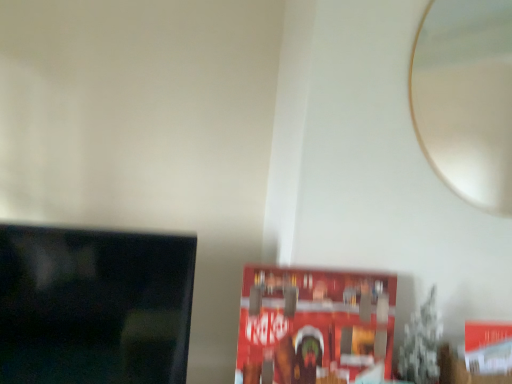
Question: Is white glossy mirror at upper right shorter than black glossy tv at left?

Choices:
 (A) no
 (B) yes

Answer: (A)

Question: Could black glossy tv at left be considered to be inside white glossy mirror at upper right?

Choices:
 (A) no
 (B) yes

Answer: (A)

Question: Is white glossy mirror at upper right located outside black glossy tv at left?

Choices:
 (A) yes
 (B) no

Answer: (A)

Question: Is white glossy mirror at upper right smaller than black glossy tv at left?

Choices:
 (A) yes
 (B) no

Answer: (A)

Question: From the image's perspective, is white glossy mirror at upper right below black glossy tv at left?

Choices:
 (A) no
 (B) yes

Answer: (A)

Question: From a real-world perspective, is white glossy mirror at upper right positioned above or below red matte paperback book at center?

Choices:
 (A) above
 (B) below

Answer: (A)

Question: Considering the positions of white glossy mirror at upper right and red matte paperback book at center in the image, is white glossy mirror at upper right wider or thinner than red matte paperback book at center?

Choices:
 (A) thin
 (B) wide

Answer: (A)

Question: From the image's perspective, is white glossy mirror at upper right located above or below red matte paperback book at center?

Choices:
 (A) above
 (B) below

Answer: (A)

Question: Is point (477, 172) positioned closer to the camera than point (284, 367)?

Choices:
 (A) closer
 (B) farther

Answer: (B)

Question: In terms of size, does black glossy tv at left appear bigger or smaller than white glossy mirror at upper right?

Choices:
 (A) small
 (B) big

Answer: (B)

Question: Considering the positions of point (53, 249) and point (454, 71), is point (53, 249) closer or farther from the camera than point (454, 71)?

Choices:
 (A) closer
 (B) farther

Answer: (A)

Question: Would you say black glossy tv at left is to the left or to the right of white glossy mirror at upper right in the picture?

Choices:
 (A) right
 (B) left

Answer: (B)

Question: Is black glossy tv at left in front of or behind white glossy mirror at upper right in the image?

Choices:
 (A) front
 (B) behind

Answer: (A)

Question: In terms of size, does white glossy mirror at upper right appear bigger or smaller than black glossy tv at left?

Choices:
 (A) big
 (B) small

Answer: (B)

Question: From a real-world perspective, is white glossy mirror at upper right above or below black glossy tv at left?

Choices:
 (A) below
 (B) above

Answer: (B)